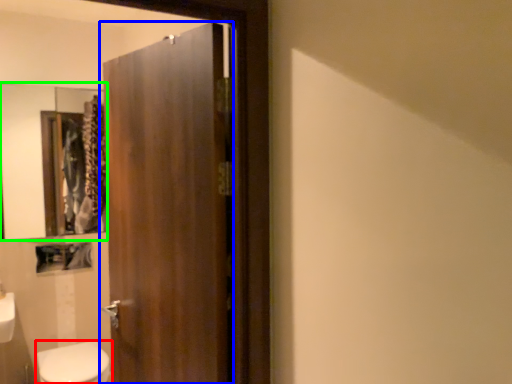
Question: Based on their relative distances, which object is farther from bidet (highlighted by a red box)? Choose from door (highlighted by a blue box) and mirror (highlighted by a green box).

Choices:
 (A) door
 (B) mirror

Answer: (B)